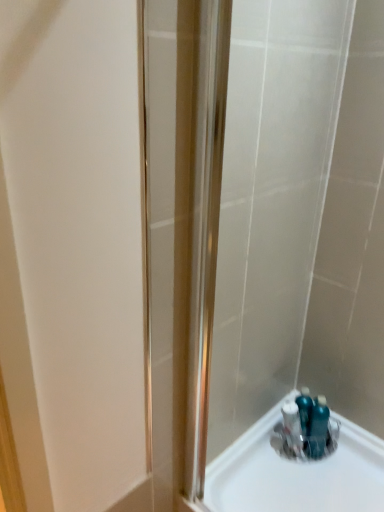
What do you see at coordinates (232, 212) in the screenshot? I see `satin nickel shower door at center` at bounding box center [232, 212].

At what (x,y) coordinates should I click in order to perform the action: click on clear plastic container at bottom right, which ranks as the second sink in right-to-left order. Please return your answer as a coordinate pair (x, y). The width and height of the screenshot is (384, 512). Looking at the image, I should click on (297, 472).

In the image, is blue glossy bottles at bottom right, the 2th sink in the left-to-right sequence, on the left side or the right side of satin nickel shower door at center?

blue glossy bottles at bottom right, the 2th sink in the left-to-right sequence, is positioned on satin nickel shower door at center's right side.

From a real-world perspective, count 1st sinks downward from the satin nickel shower door at center and point to it. Please provide its 2D coordinates.

[(306, 428)]

From a real-world perspective, is blue glossy bottles at bottom right, the 2th sink in the left-to-right sequence, positioned above or below satin nickel shower door at center?

blue glossy bottles at bottom right, the 2th sink in the left-to-right sequence, is situated lower than satin nickel shower door at center in the real world.

Is blue glossy bottles at bottom right, the 2th sink in the left-to-right sequence, beside satin nickel shower door at center?

No, blue glossy bottles at bottom right, the 2th sink in the left-to-right sequence, is not beside satin nickel shower door at center.

Is satin nickel shower door at center to the right of blue glossy bottles at bottom right, which is the first sink from right to left, from the viewer's perspective?

No, satin nickel shower door at center is not to the right of blue glossy bottles at bottom right, which is the first sink from right to left.

From a real-world perspective, is satin nickel shower door at center on blue glossy bottles at bottom right, which is the first sink from right to left?

Yes, from a real-world perspective, satin nickel shower door at center is over blue glossy bottles at bottom right, which is the first sink from right to left

Which object is thinner, satin nickel shower door at center or blue glossy bottles at bottom right, the 2th sink in the left-to-right sequence?

blue glossy bottles at bottom right, the 2th sink in the left-to-right sequence, is thinner.

From the image's perspective, would you say satin nickel shower door at center is shown under blue glossy bottles at bottom right, the 2th sink in the left-to-right sequence?

No.

Is satin nickel shower door at center not close to clear plastic container at bottom right, the first sink viewed from the left?

That's not correct — satin nickel shower door at center is a little close to clear plastic container at bottom right, the first sink viewed from the left.

From a real-world perspective, is satin nickel shower door at center above or below clear plastic container at bottom right, the first sink viewed from the left?

In terms of real-world spatial position, satin nickel shower door at center is above clear plastic container at bottom right, the first sink viewed from the left.

How different are the orientations of satin nickel shower door at center and clear plastic container at bottom right, which ranks as the second sink in right-to-left order, in degrees?

There is a 1.53-degree angle between the facing directions of satin nickel shower door at center and clear plastic container at bottom right, which ranks as the second sink in right-to-left order.

Can you confirm if satin nickel shower door at center is wider than clear plastic container at bottom right, which ranks as the second sink in right-to-left order?

In fact, satin nickel shower door at center might be narrower than clear plastic container at bottom right, which ranks as the second sink in right-to-left order.

Can you tell me how much blue glossy bottles at bottom right, which is the first sink from right to left, and clear plastic container at bottom right, which ranks as the second sink in right-to-left order, differ in facing direction?

There is a 1.5-degree angle between the facing directions of blue glossy bottles at bottom right, which is the first sink from right to left, and clear plastic container at bottom right, which ranks as the second sink in right-to-left order.

Which is in front, point (275, 431) or point (280, 494)?

The point (280, 494) is more forward.

Between blue glossy bottles at bottom right, which is the first sink from right to left, and clear plastic container at bottom right, the first sink viewed from the left, which one appears on the left side from the viewer's perspective?

clear plastic container at bottom right, the first sink viewed from the left.

Considering the sizes of objects clear plastic container at bottom right, which ranks as the second sink in right-to-left order, and blue glossy bottles at bottom right, which is the first sink from right to left, in the image provided, who is wider, clear plastic container at bottom right, which ranks as the second sink in right-to-left order, or blue glossy bottles at bottom right, which is the first sink from right to left,?

Answer: With larger width is clear plastic container at bottom right, which ranks as the second sink in right-to-left order.

From the image's perspective, does clear plastic container at bottom right, which ranks as the second sink in right-to-left order, appear higher than blue glossy bottles at bottom right, which is the first sink from right to left?

Actually, clear plastic container at bottom right, which ranks as the second sink in right-to-left order, appears below blue glossy bottles at bottom right, which is the first sink from right to left, in the image.

Is clear plastic container at bottom right, the first sink viewed from the left, far from blue glossy bottles at bottom right, the 2th sink in the left-to-right sequence?

Actually, clear plastic container at bottom right, the first sink viewed from the left, and blue glossy bottles at bottom right, the 2th sink in the left-to-right sequence, are a little close together.

Considering the relative sizes of clear plastic container at bottom right, the first sink viewed from the left, and blue glossy bottles at bottom right, the 2th sink in the left-to-right sequence, in the image provided, is clear plastic container at bottom right, the first sink viewed from the left, shorter than blue glossy bottles at bottom right, the 2th sink in the left-to-right sequence,?

Correct, clear plastic container at bottom right, the first sink viewed from the left, is not as tall as blue glossy bottles at bottom right, the 2th sink in the left-to-right sequence.

From a real-world perspective, is clear plastic container at bottom right, the first sink viewed from the left, located beneath satin nickel shower door at center?

Indeed, from a real-world perspective, clear plastic container at bottom right, the first sink viewed from the left, is positioned beneath satin nickel shower door at center.

Which is more to the right, clear plastic container at bottom right, the first sink viewed from the left, or satin nickel shower door at center?

From the viewer's perspective, clear plastic container at bottom right, the first sink viewed from the left, appears more on the right side.

Considering the relative sizes of clear plastic container at bottom right, which ranks as the second sink in right-to-left order, and satin nickel shower door at center in the image provided, is clear plastic container at bottom right, which ranks as the second sink in right-to-left order, bigger than satin nickel shower door at center?

No, clear plastic container at bottom right, which ranks as the second sink in right-to-left order, is not bigger than satin nickel shower door at center.

Is clear plastic container at bottom right, which ranks as the second sink in right-to-left order, oriented away from satin nickel shower door at center?

No, clear plastic container at bottom right, which ranks as the second sink in right-to-left order, is not facing away from satin nickel shower door at center.

Identify the location of sink that is the 1st one below the satin nickel shower door at center (from a real-world perspective). (306, 428).

Where is `the 2nd sink to the right of the satin nickel shower door at center, counting from the anchor's position`? The image size is (384, 512). the 2nd sink to the right of the satin nickel shower door at center, counting from the anchor's position is located at coordinates (306, 428).

Looking at the image, which one is located closer to clear plastic container at bottom right, the first sink viewed from the left, satin nickel shower door at center or blue glossy bottles at bottom right, which is the first sink from right to left?

blue glossy bottles at bottom right, which is the first sink from right to left, is closer to clear plastic container at bottom right, the first sink viewed from the left.

When comparing their distances from satin nickel shower door at center, does clear plastic container at bottom right, which ranks as the second sink in right-to-left order, or blue glossy bottles at bottom right, which is the first sink from right to left, seem closer?

Based on the image, clear plastic container at bottom right, which ranks as the second sink in right-to-left order, appears to be nearer to satin nickel shower door at center.

Based on their spatial positions, is satin nickel shower door at center or clear plastic container at bottom right, which ranks as the second sink in right-to-left order, closer to blue glossy bottles at bottom right, the 2th sink in the left-to-right sequence?

clear plastic container at bottom right, which ranks as the second sink in right-to-left order, is closer to blue glossy bottles at bottom right, the 2th sink in the left-to-right sequence.

When comparing their distances from satin nickel shower door at center, does blue glossy bottles at bottom right, the 2th sink in the left-to-right sequence, or clear plastic container at bottom right, which ranks as the second sink in right-to-left order, seem further?

blue glossy bottles at bottom right, the 2th sink in the left-to-right sequence, lies further to satin nickel shower door at center than the other object.

In the scene shown: Based on their spatial positions, is blue glossy bottles at bottom right, which is the first sink from right to left, or satin nickel shower door at center further from clear plastic container at bottom right, the first sink viewed from the left?

Based on the image, satin nickel shower door at center appears to be further to clear plastic container at bottom right, the first sink viewed from the left.

Which object lies further to the anchor point blue glossy bottles at bottom right, which is the first sink from right to left, clear plastic container at bottom right, which ranks as the second sink in right-to-left order, or satin nickel shower door at center?

Based on the image, satin nickel shower door at center appears to be further to blue glossy bottles at bottom right, which is the first sink from right to left.

This screenshot has width=384, height=512. I want to click on sink between satin nickel shower door at center and blue glossy bottles at bottom right, the 2th sink in the left-to-right sequence, in the front-back direction, so click(297, 472).